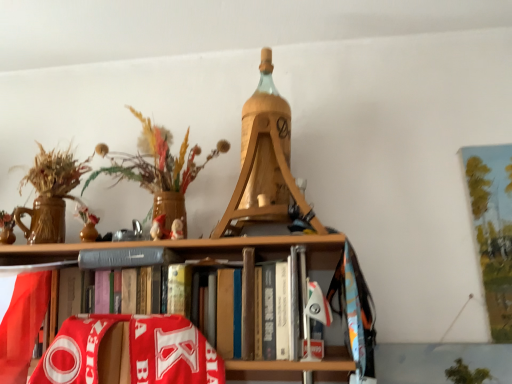
Question: Is hardcover book at center bigger or smaller than wooden vase with dried flowers at upper left?

Choices:
 (A) small
 (B) big

Answer: (B)

Question: From the image's perspective, relative to wooden vase with dried flowers at upper left, is hardcover book at center above or below?

Choices:
 (A) above
 (B) below

Answer: (B)

Question: Which is nearer to the wooden vase with dried flowers at upper left?

Choices:
 (A) gray matte book at center
 (B) hardcover book at center

Answer: (A)

Question: Which is nearer to the wooden vase with dried flowers at upper left?

Choices:
 (A) hardcover book at center
 (B) gray matte book at center

Answer: (B)